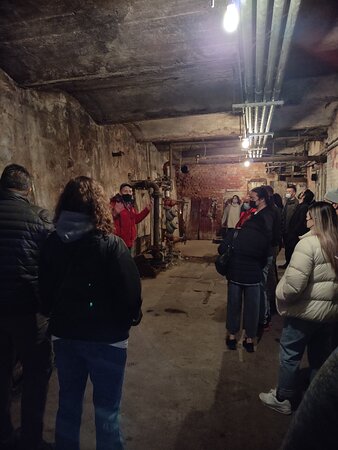
What are the coordinates of `overhead lighting` in the screenshot? It's located at (230, 20), (245, 146), (245, 163).